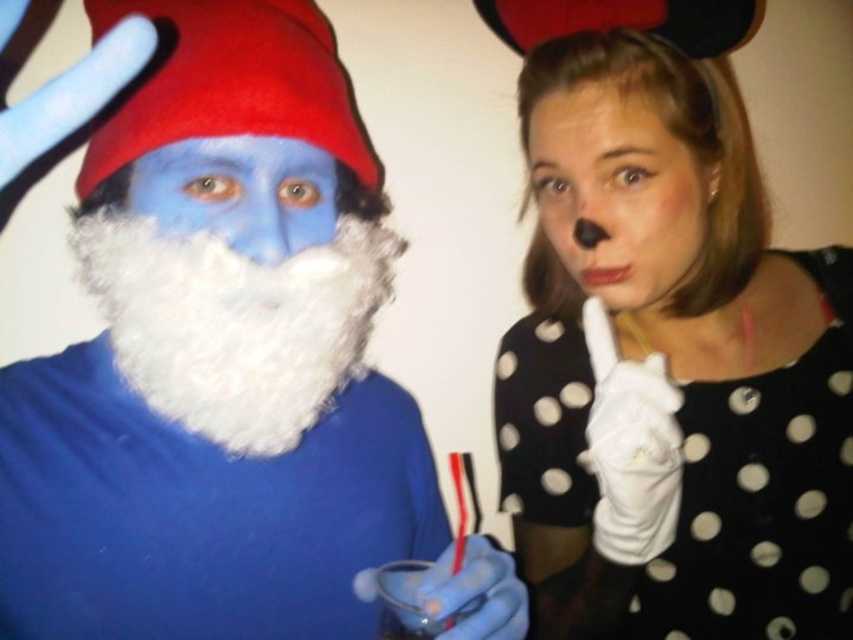
You are planning to take a photo of the two costumed individuals. You want to ensure that both the white polka dot dress at center and the matte black nose at center are clearly visible. Considering their sizes, which object should you focus on to ensure both are in frame?

The white polka dot dress at center is larger than the matte black nose at center, so focusing on the dress will ensure both are in frame as it is bigger and easier to spot.

You are a photographer setting up for a group photo. You need to ensure that the white fluffy beard at center and the matte black nose at center are both clearly visible in the frame. Given that your camera has a depth of field that can sharply focus on objects within a 10 inch range, will both features be in focus at the same time?

The white fluffy beard at center is 12.58 inches away from the matte black nose at center. Since the distance between them exceeds the camera sensor depth of field range of 10 inches, both features cannot be in focus simultaneously.